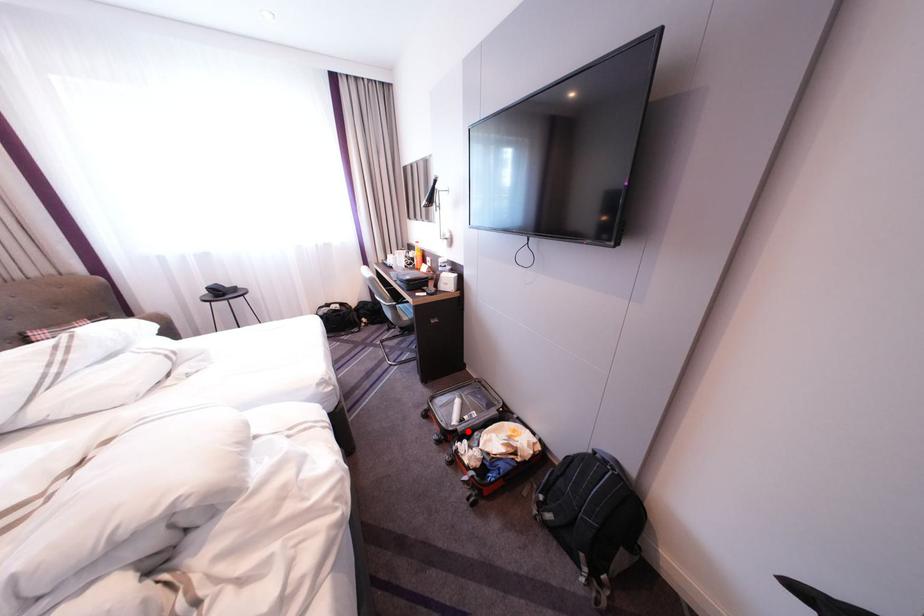
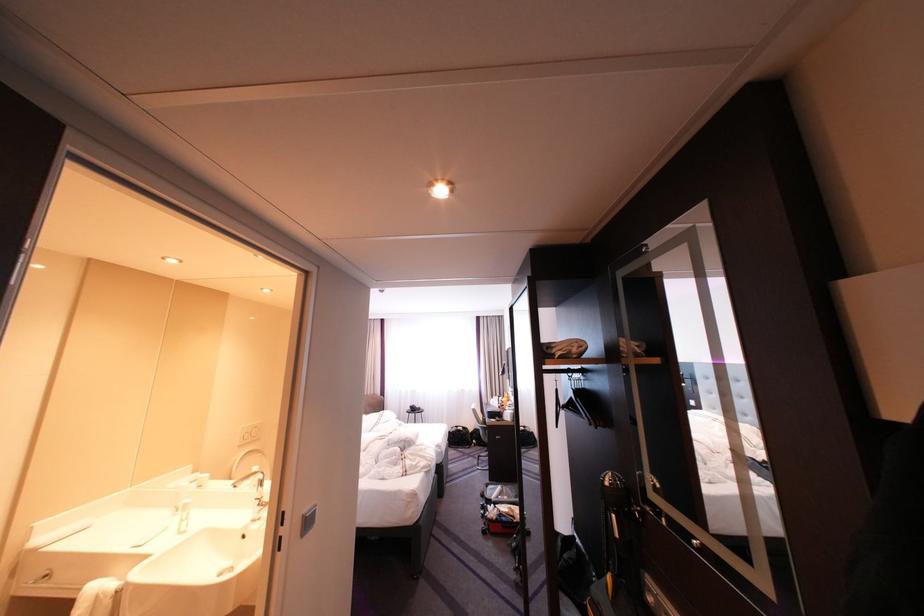
Question: A red point is marked in image1. In image2, is the corresponding 3D point closer to the camera or farther? Reply with the corresponding letter.

Choices:
 (A) The corresponding 3D point is closer.
 (B) The corresponding 3D point is farther.

Answer: (A)